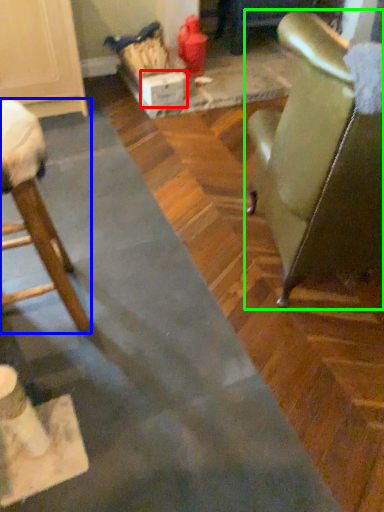
Question: Based on their relative distances, which object is farther from cardboard box (highlighted by a red box)? Choose from chair (highlighted by a blue box) and chair (highlighted by a green box).

Choices:
 (A) chair
 (B) chair

Answer: (B)